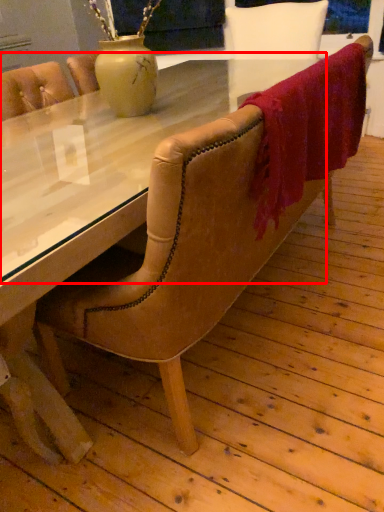
Question: From the image's perspective, what is the correct spatial relationship of glass table (annotated by the red box) in relation to blanket?

Choices:
 (A) below
 (B) above

Answer: (A)